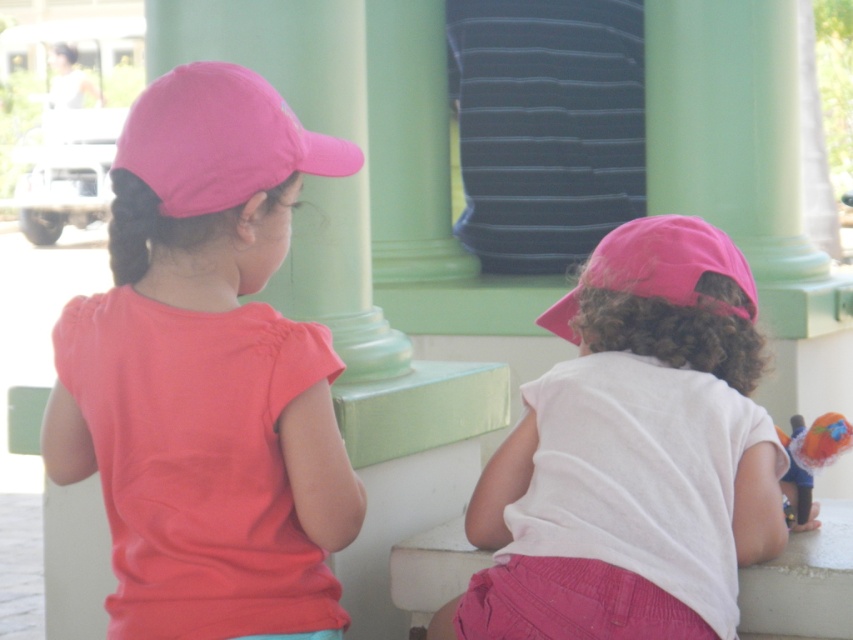
Question: Is matte pink cap at upper left smaller than pink fabric cap at center?

Choices:
 (A) no
 (B) yes

Answer: (B)

Question: Does pink fabric cap at center have a greater width compared to pink fabric cap at upper left?

Choices:
 (A) no
 (B) yes

Answer: (B)

Question: Which point is farther to the camera?

Choices:
 (A) pink matte baseball cap at center
 (B) pink fabric cap at center

Answer: (A)

Question: Does pink fabric cap at center have a greater width compared to pink fabric cap at upper left?

Choices:
 (A) yes
 (B) no

Answer: (A)

Question: Which point is farther to the camera?

Choices:
 (A) matte pink cap at upper left
 (B) pink matte baseball cap at center
 (C) pink fabric cap at upper left

Answer: (B)

Question: Which point appears closest to the camera in this image?

Choices:
 (A) (283, 163)
 (B) (670, 531)

Answer: (A)